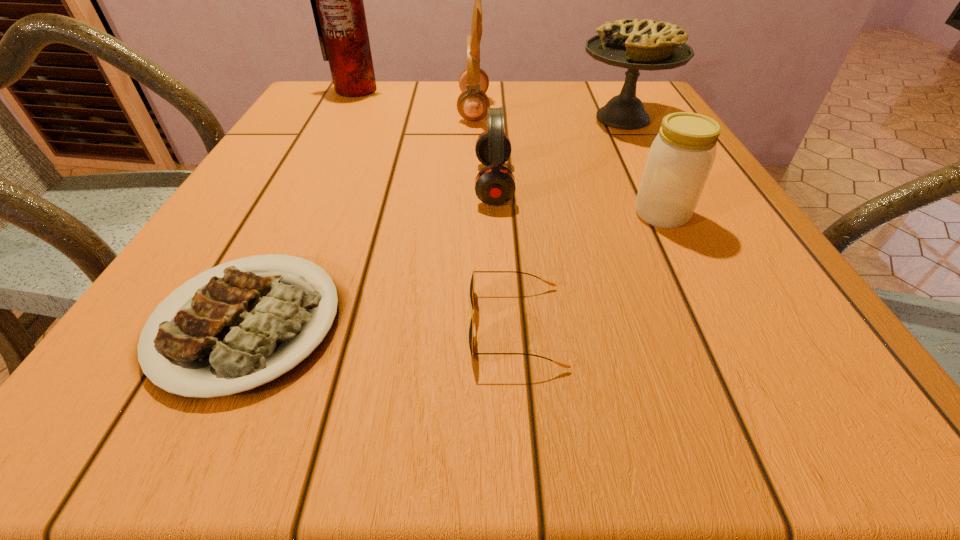
Locate an element on the screen. the tallest object is located at coordinates (337, 3).

Image resolution: width=960 pixels, height=540 pixels. In order to click on the second tallest object in this screenshot , I will do `click(472, 103)`.

Where is `the taller earphone`? the taller earphone is located at coordinates (472, 103).

Find the location of a particular element. the fifth shortest object is located at coordinates (636, 44).

You are a GUI agent. You are given a task and a screenshot of the screen. Output one action in this format:
    pyautogui.click(x=<x>, y=<y>)
    Task: Click on the jar
    This screenshot has height=540, width=960.
    Given the screenshot: What is the action you would take?
    pyautogui.click(x=681, y=156)

Where is `the nearer earphone`? The image size is (960, 540). the nearer earphone is located at coordinates (495, 184).

In order to click on the shorter earphone in this screenshot , I will do `click(495, 184)`.

Locate an element on the screen. This screenshot has width=960, height=540. the sixth tallest object is located at coordinates (471, 339).

Where is `the shortest object`? the shortest object is located at coordinates (244, 333).

At what (x,y) coordinates should I click in order to perform the action: click on free region located on the nozzle side of the tallest object. Please return your answer as a coordinate pair (x, y). This screenshot has width=960, height=540. Looking at the image, I should click on (340, 119).